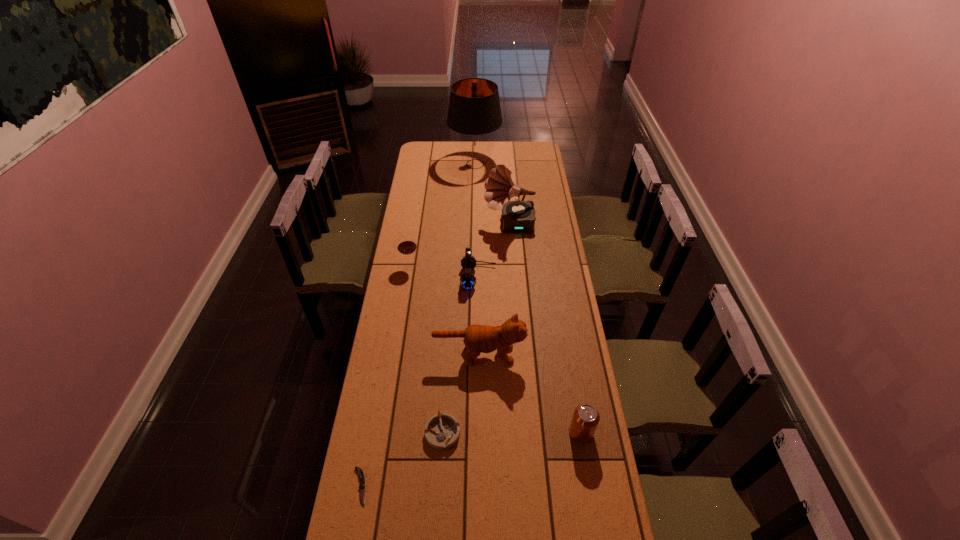
Identify the location of the nearest object. (361, 475).

At what (x,y) coordinates should I click in order to perform the action: click on the shortest object. Please return your answer as a coordinate pair (x, y). Image resolution: width=960 pixels, height=540 pixels. Looking at the image, I should click on (361, 475).

Find the location of `vacant area situated 0.110m on the right of the farthest object`. vacant area situated 0.110m on the right of the farthest object is located at coordinates (519, 164).

Image resolution: width=960 pixels, height=540 pixels. I want to click on vacant space located from the horn of the record player, so click(x=433, y=225).

You are a GUI agent. You are given a task and a screenshot of the screen. Output one action in this format:
    pyautogui.click(x=<x>, y=<y>)
    Task: Click on the vacant space located 0.070m from the horn of the record player
    
    Given the screenshot: What is the action you would take?
    pyautogui.click(x=470, y=225)

The width and height of the screenshot is (960, 540). Find the location of `vacant space located from the horn of the record player`. vacant space located from the horn of the record player is located at coordinates (470, 225).

In order to click on vacant area situated on the face of the fourth nearest object in this screenshot , I will do `click(582, 354)`.

At what (x,y) coordinates should I click in order to perform the action: click on free location located 0.250m on the ear cushions of the headset. Please return your answer as a coordinate pair (x, y). Looking at the image, I should click on (551, 278).

Locate an element on the screen. The height and width of the screenshot is (540, 960). free region located on the back of the wineglass is located at coordinates (412, 253).

Find the location of a particular element. The width and height of the screenshot is (960, 540). blank space located on the left of the can is located at coordinates (484, 433).